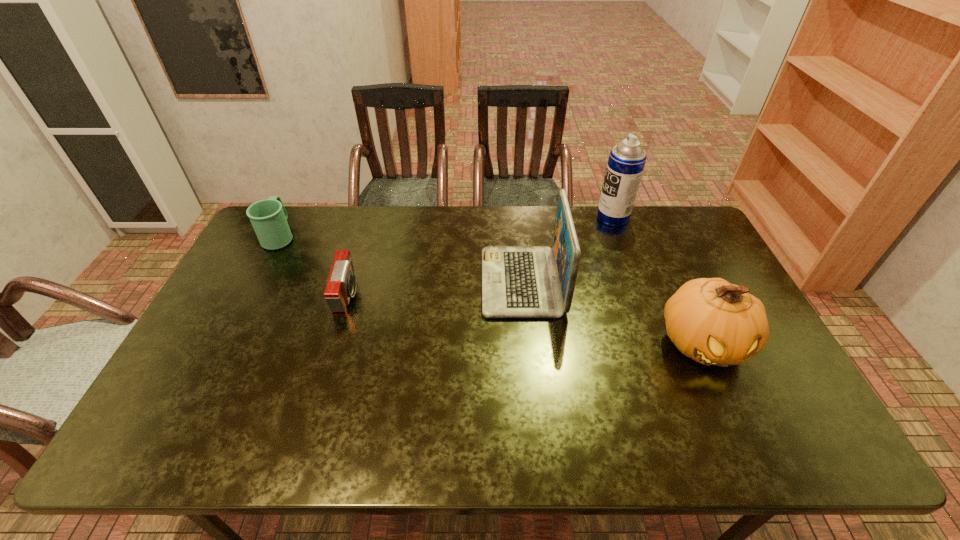
Locate an element on the screen. This screenshot has width=960, height=540. empty space that is in between the tallest object and the pumpkin is located at coordinates (658, 280).

Where is `free space between the laptop computer and the second object from left to right`? The height and width of the screenshot is (540, 960). free space between the laptop computer and the second object from left to right is located at coordinates (435, 289).

Identify the location of vacant area between the second shortest object and the camera. This screenshot has width=960, height=540. (313, 266).

At what (x,y) coordinates should I click in order to perform the action: click on empty space between the pumpkin and the third object from left to right. Please return your answer as a coordinate pair (x, y). Image resolution: width=960 pixels, height=540 pixels. Looking at the image, I should click on (612, 313).

Choose which object is the fourth nearest neighbor to the aerosol can. Please provide its 2D coordinates. Your answer should be formatted as a tuple, i.e. [(x, y)], where the tuple contains the x and y coordinates of a point satisfying the conditions above.

[(268, 217)]

Locate an element on the screen. Image resolution: width=960 pixels, height=540 pixels. object that ranks as the closest to the third object from right to left is located at coordinates (626, 162).